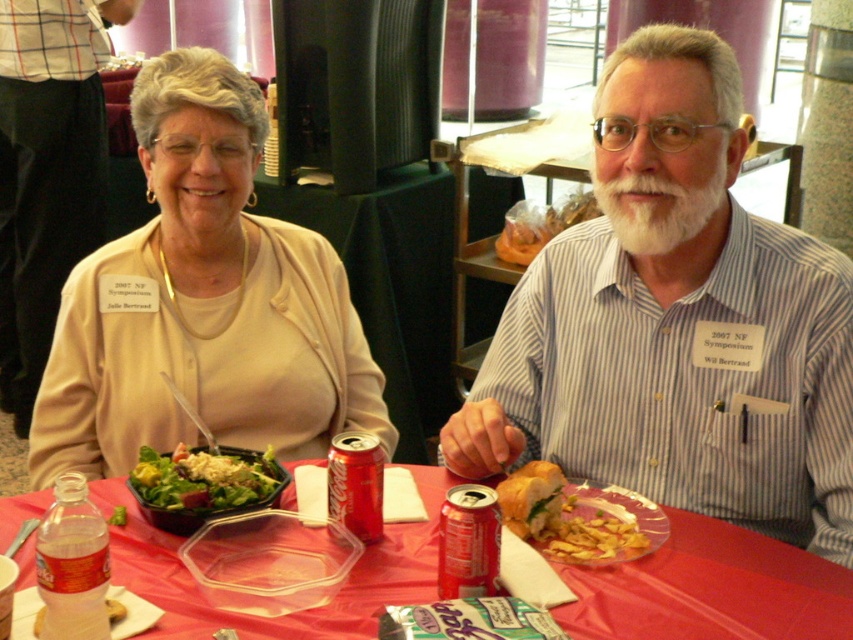
Question: Among these objects, which one is nearest to the camera?

Choices:
 (A) striped cotton shirt at center
 (B) clear plastic bottle at table center
 (C) red matte can at center
 (D) matte yellow shirt at upper left

Answer: (B)

Question: Which is nearer to the clear plastic bottle at table center?

Choices:
 (A) fresh green salad at left
 (B) matte yellow shirt at upper left
 (C) red matte soda can at center
 (D) golden bread sandwich at center

Answer: (A)

Question: Can you confirm if striped cotton shirt at center is positioned to the left of red matte can at center?

Choices:
 (A) no
 (B) yes

Answer: (A)

Question: Estimate the real-world distances between objects in this image. Which object is closer to the clear plastic bottle at table center?

Choices:
 (A) matte yellow shirt at upper left
 (B) matte beige sweater at upper left
 (C) red plastic table at center
 (D) golden bread sandwich at center

Answer: (C)

Question: Is red plastic table at center bigger than matte yellow shirt at upper left?

Choices:
 (A) yes
 (B) no

Answer: (B)

Question: Does red plastic table at center have a smaller size compared to fresh green salad at left?

Choices:
 (A) yes
 (B) no

Answer: (B)